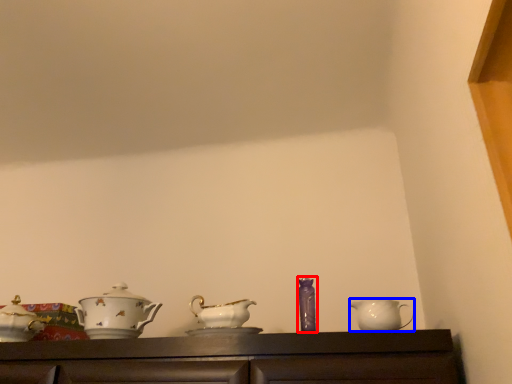
Question: Which of the following is the closest to the observer, tableware (highlighted by a red box) or jug (highlighted by a blue box)?

Choices:
 (A) tableware
 (B) jug

Answer: (B)